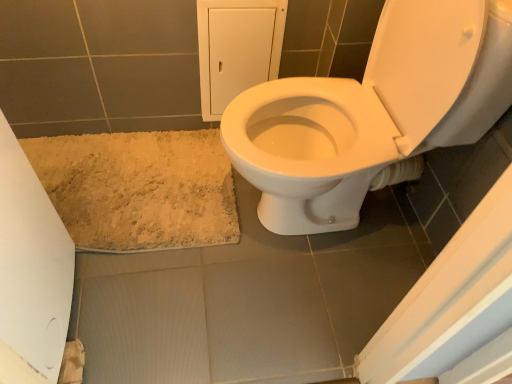
Locate an element on the screen. This screenshot has width=512, height=384. beige shaggy bath mat at lower left is located at coordinates (139, 189).

At what (x,y) coordinates should I click in order to perform the action: click on white paper at lower left. Please return your answer as a coordinate pair (x, y). Looking at the image, I should click on (72, 363).

Where is `white glossy toilet at center`? white glossy toilet at center is located at coordinates (373, 113).

Is beige shaggy bath mat at lower left in front of or behind white glossy toilet at center in the image?

beige shaggy bath mat at lower left is positioned farther from the viewer than white glossy toilet at center.

Which of these two, beige shaggy bath mat at lower left or white glossy toilet at center, is wider?

white glossy toilet at center.

Which is in front, point (160, 162) or point (296, 149)?

The point (296, 149) is in front.

From the picture: Between beige shaggy bath mat at lower left and white paper at lower left, which one has larger width?

Wider between the two is beige shaggy bath mat at lower left.

From a real-world perspective, is beige shaggy bath mat at lower left under white paper at lower left?

No, from a real-world perspective, beige shaggy bath mat at lower left is not under white paper at lower left.

Consider the image. Is beige shaggy bath mat at lower left not inside white paper at lower left?

beige shaggy bath mat at lower left lies outside white paper at lower left's area.

Are beige shaggy bath mat at lower left and white paper at lower left making contact?

No, beige shaggy bath mat at lower left is not making contact with white paper at lower left.

In the scene shown: From the image's perspective, is white glossy toilet at center beneath beige shaggy bath mat at lower left?

No.

Does white glossy toilet at center have a smaller size compared to beige shaggy bath mat at lower left?

No, white glossy toilet at center is not smaller than beige shaggy bath mat at lower left.

Is white glossy toilet at center wider or thinner than beige shaggy bath mat at lower left?

In the image, white glossy toilet at center appears to be wider than beige shaggy bath mat at lower left.

Does point (78, 360) come in front of point (348, 107)?

Yes, point (78, 360) is closer to viewer.

Between white paper at lower left and white glossy toilet at center, which one has less height?

With less height is white paper at lower left.

You are a GUI agent. You are given a task and a screenshot of the screen. Output one action in this format:
    pyautogui.click(x=<x>, y=<y>)
    Task: Click on the toilet above the white paper at lower left (from a real-world perspective)
    This screenshot has height=384, width=512.
    Given the screenshot: What is the action you would take?
    pyautogui.click(x=373, y=113)

From a real-world perspective, is white paper at lower left on top of white glossy toilet at center?

No.

Considering the sizes of objects white glossy toilet at center and white paper at lower left in the image provided, who is wider, white glossy toilet at center or white paper at lower left?

white glossy toilet at center.

Is point (366, 161) farther from camera compared to point (64, 352)?

No, (366, 161) is in front of (64, 352).

Can you confirm if white glossy toilet at center is shorter than white paper at lower left?

No, white glossy toilet at center is not shorter than white paper at lower left.

Is white glossy toilet at center oriented towards white paper at lower left?

No, white glossy toilet at center does not turn towards white paper at lower left.

From the image's perspective, which object appears higher, white paper at lower left or beige shaggy bath mat at lower left?

beige shaggy bath mat at lower left is shown above in the image.

This screenshot has width=512, height=384. In order to click on bath mat behind the white paper at lower left in this screenshot , I will do `click(139, 189)`.

Is point (78, 381) positioned after point (136, 141)?

No, it is not.

Image resolution: width=512 pixels, height=384 pixels. What are the coordinates of `bath mat directly beneath the white glossy toilet at center (from a real-world perspective)` in the screenshot? It's located at (139, 189).

You are a GUI agent. You are given a task and a screenshot of the screen. Output one action in this format:
    pyautogui.click(x=<x>, y=<y>)
    Task: Click on the bath mat behind the white paper at lower left
    The width and height of the screenshot is (512, 384).
    Given the screenshot: What is the action you would take?
    coord(139,189)

Based on their spatial positions, is beige shaggy bath mat at lower left or white paper at lower left closer to white glossy toilet at center?

Based on the image, beige shaggy bath mat at lower left appears to be nearer to white glossy toilet at center.

From the image, which object appears to be nearer to white paper at lower left, beige shaggy bath mat at lower left or white glossy toilet at center?

beige shaggy bath mat at lower left.

Looking at the image, which one is located further to beige shaggy bath mat at lower left, white paper at lower left or white glossy toilet at center?

white paper at lower left lies further to beige shaggy bath mat at lower left than the other object.

From the image, which object appears to be farther from white paper at lower left, white glossy toilet at center or beige shaggy bath mat at lower left?

white glossy toilet at center is positioned further to the anchor white paper at lower left.

When comparing their distances from white glossy toilet at center, does white paper at lower left or beige shaggy bath mat at lower left seem closer?

beige shaggy bath mat at lower left is positioned closer to the anchor white glossy toilet at center.

Estimate the real-world distances between objects in this image. Which object is closer to beige shaggy bath mat at lower left, white glossy toilet at center or white paper at lower left?

The object closer to beige shaggy bath mat at lower left is white glossy toilet at center.

This screenshot has width=512, height=384. What are the coordinates of `toilet paper between beige shaggy bath mat at lower left and white glossy toilet at center from left to right` in the screenshot? It's located at (72, 363).